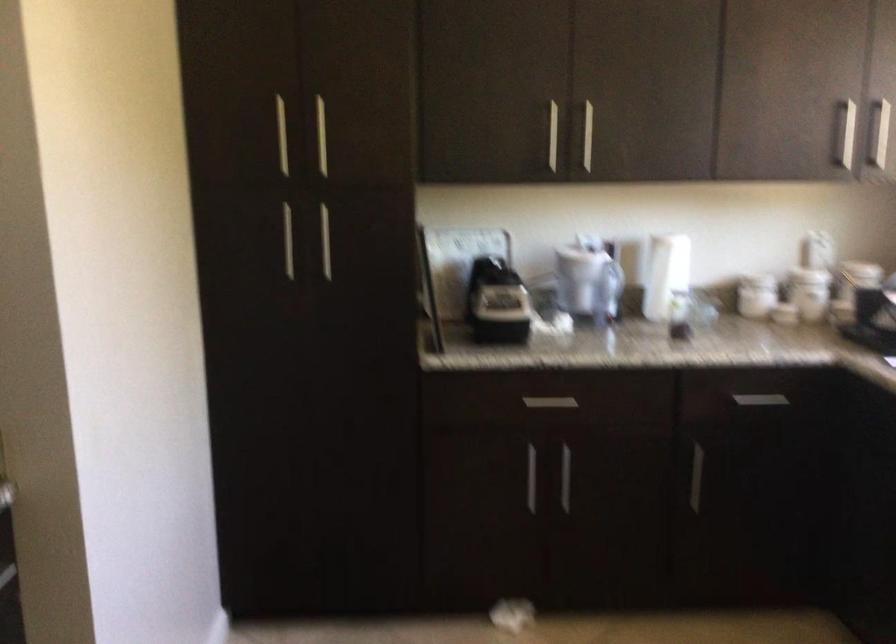
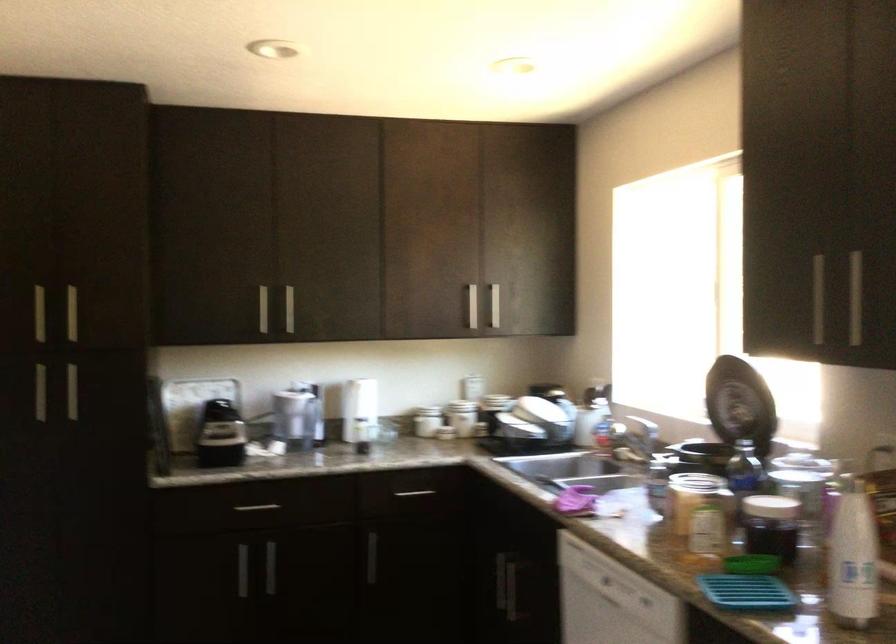
Where in the second image is the point corresponding to [587,138] from the first image?

(289, 308)